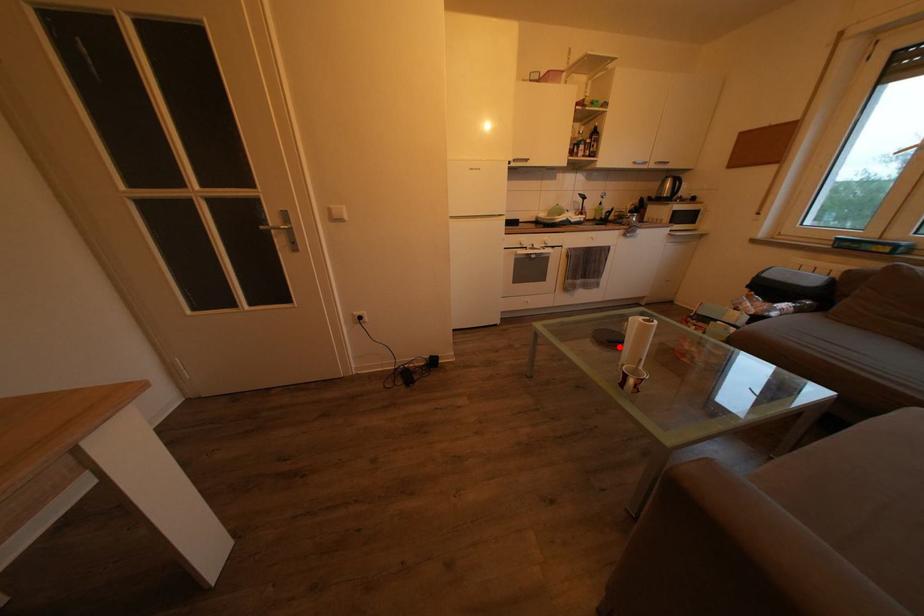
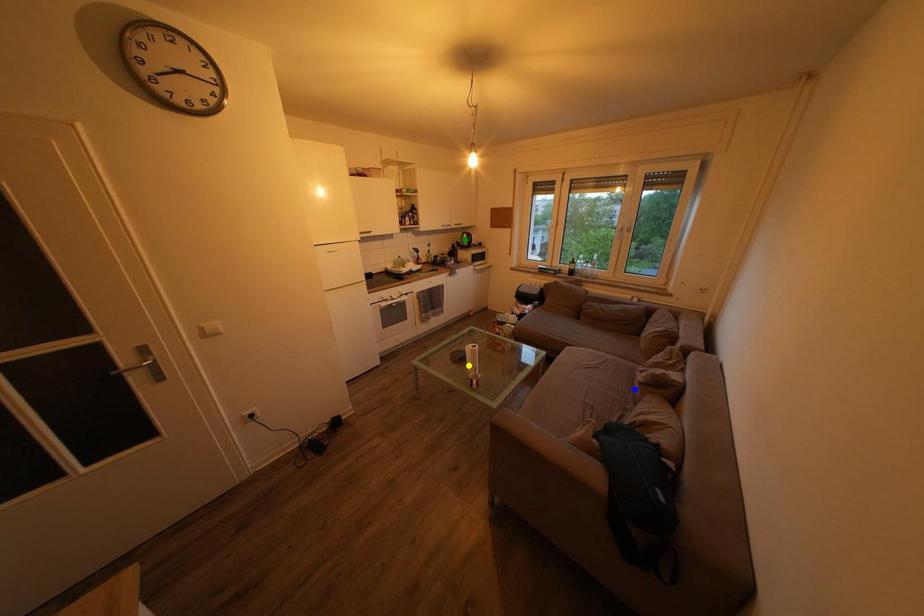
Question: I am providing you with two images of the same scene from different viewpoints. A red point is marked on the first image. You are given multiple points on the second image. Which spot in image 2 lines up with the point in image 1?

Choices:
 (A) blue point
 (B) green point
 (C) yellow point

Answer: (C)